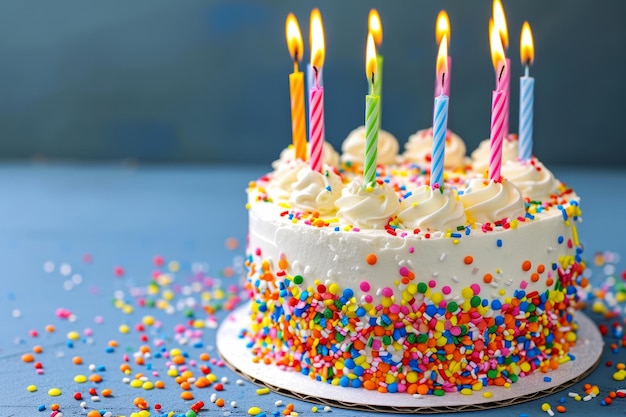
The width and height of the screenshot is (626, 417). I want to click on birthday candles, so click(295, 89), click(310, 70), click(312, 130), click(375, 126), click(444, 145), click(380, 72), click(441, 77), click(500, 129), click(531, 115), click(510, 67).